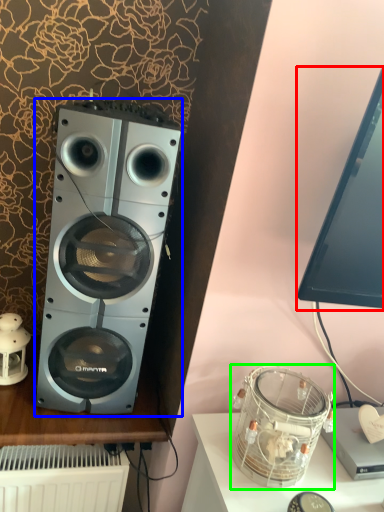
Question: Based on their relative distances, which object is farther from computer monitor (highlighted by a red box)? Choose from home appliance (highlighted by a blue box) and appliance (highlighted by a green box).

Choices:
 (A) home appliance
 (B) appliance

Answer: (A)